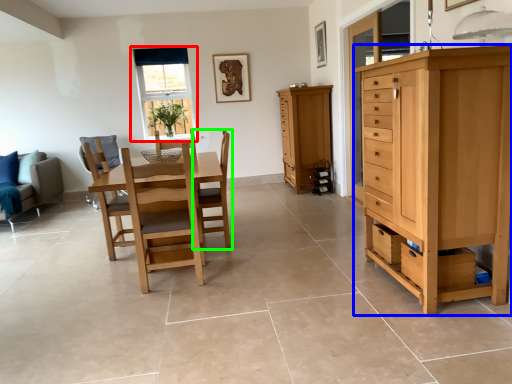
Question: Which object is positioned closest to window (highlighted by a red box)? Select from chest of drawers (highlighted by a blue box) and chair (highlighted by a green box).

Choices:
 (A) chest of drawers
 (B) chair

Answer: (B)